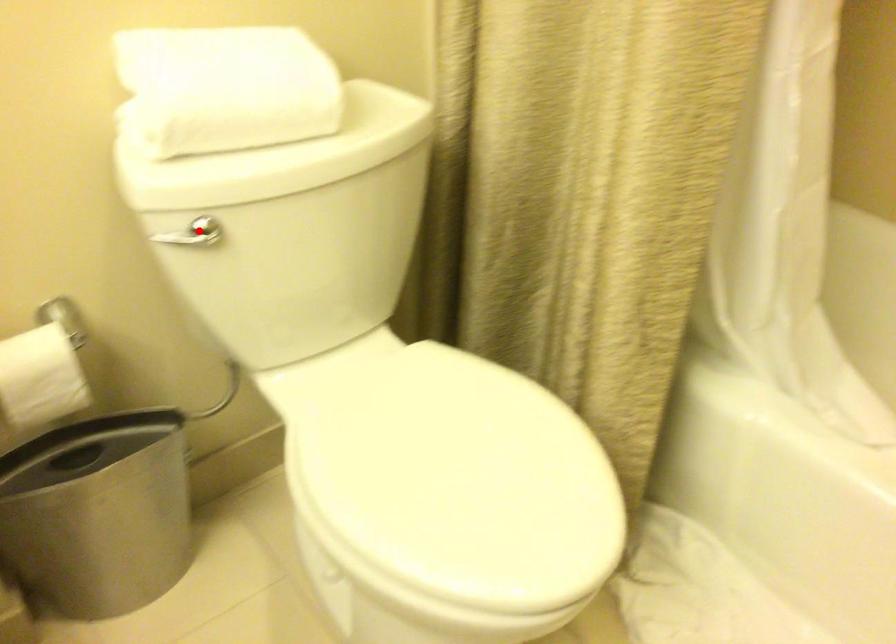
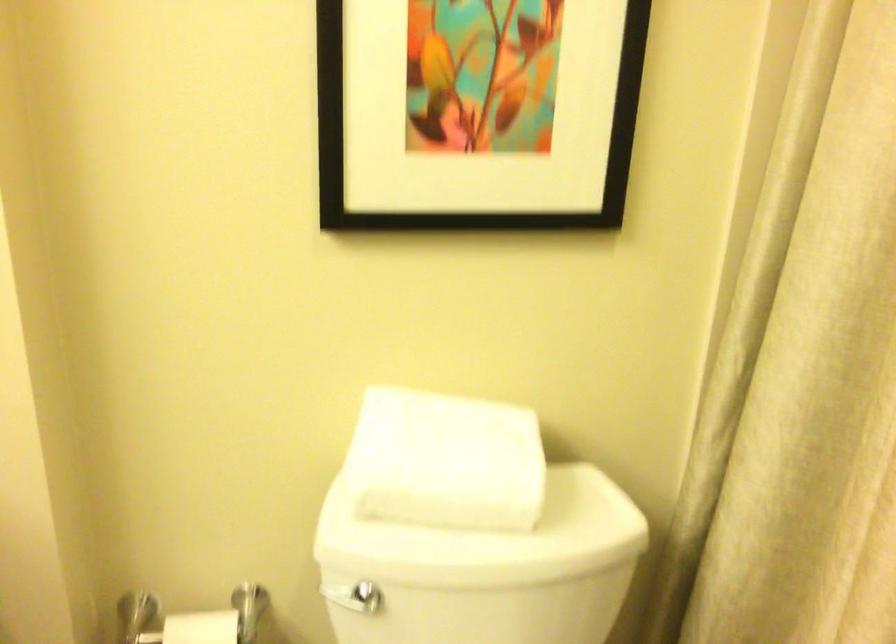
Find the pixel in the second image that matches the highlighted location in the first image.

(359, 598)